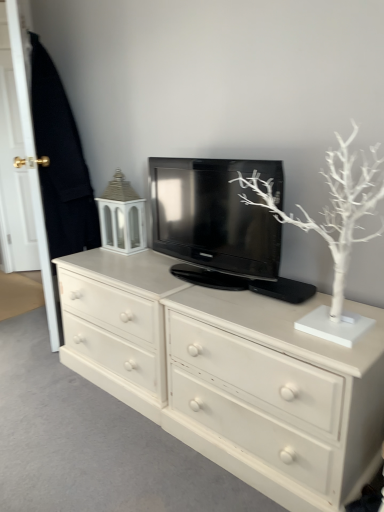
Where is `free space to the left of white wood door at left`? The height and width of the screenshot is (512, 384). free space to the left of white wood door at left is located at coordinates (24, 326).